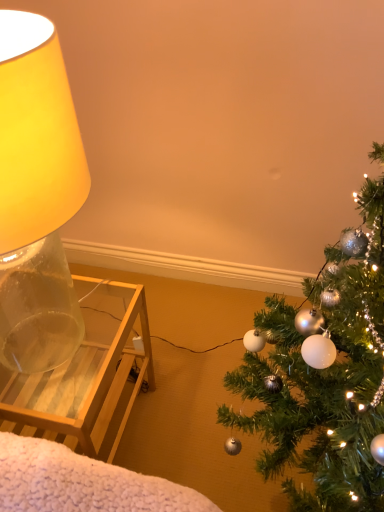
Find the location of a particular element. This screenshot has width=384, height=512. free space to the left of shiny silver ornaments at right is located at coordinates (190, 435).